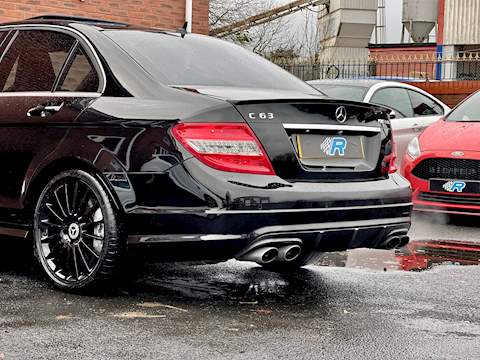
This screenshot has height=360, width=480. In order to click on door handle in this screenshot , I will do 45,108.